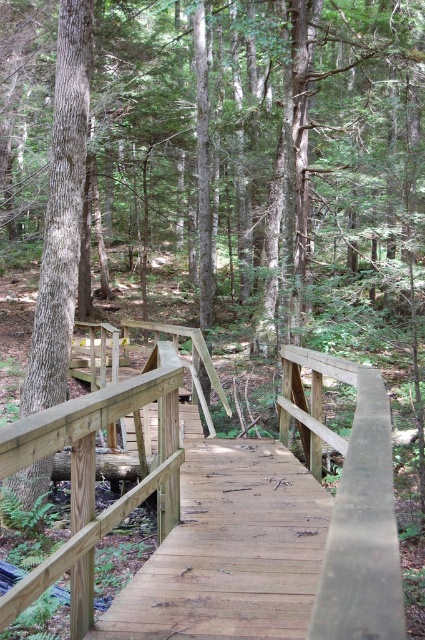
This screenshot has width=425, height=640. What are the coordinates of `wooden bridge at center` in the screenshot? It's located at (351, 504).

Does wooden bridge at center have a greater width compared to smooth brown tree trunk at left?

No, wooden bridge at center is not wider than smooth brown tree trunk at left.

Between point (28, 596) and point (67, 177), which one is positioned in front?

Point (28, 596)

The image size is (425, 640). In order to click on wooden bridge at center in this screenshot , I will do `click(351, 504)`.